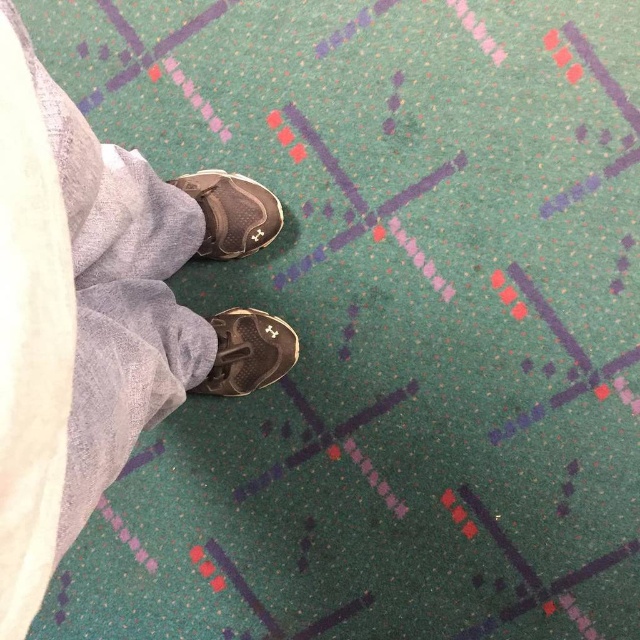
Question: Is matte gray pants at center thinner than matte gray sneaker at center?

Choices:
 (A) yes
 (B) no

Answer: (B)

Question: From the image, what is the correct spatial relationship of matte gray sneaker at center in relation to matte black sneaker at center?

Choices:
 (A) right
 (B) left

Answer: (B)

Question: Can you confirm if matte gray sneaker at center is wider than matte black sneaker at center?

Choices:
 (A) yes
 (B) no

Answer: (A)

Question: Which point is farther to the camera?

Choices:
 (A) (253, 323)
 (B) (224, 236)
 (C) (145, 397)

Answer: (A)

Question: Which point is closer to the camera taking this photo?

Choices:
 (A) (227, 353)
 (B) (268, 316)
 (C) (269, 196)

Answer: (A)

Question: Which of these objects is positioned closest to the matte gray pants at center?

Choices:
 (A) matte black sneaker at center
 (B) matte gray sneaker at center

Answer: (A)